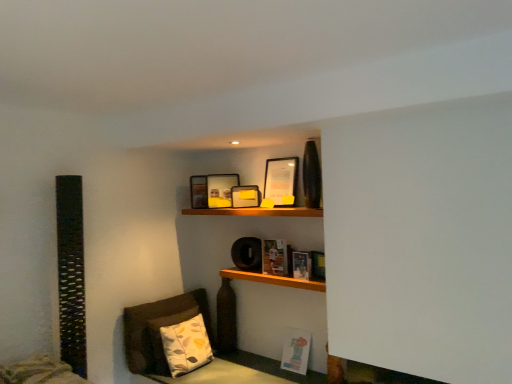
The width and height of the screenshot is (512, 384). What are the coordinates of `free space to the left of matte paper book at lower right, the 1th book when ordered from bottom to top` in the screenshot? It's located at (272, 377).